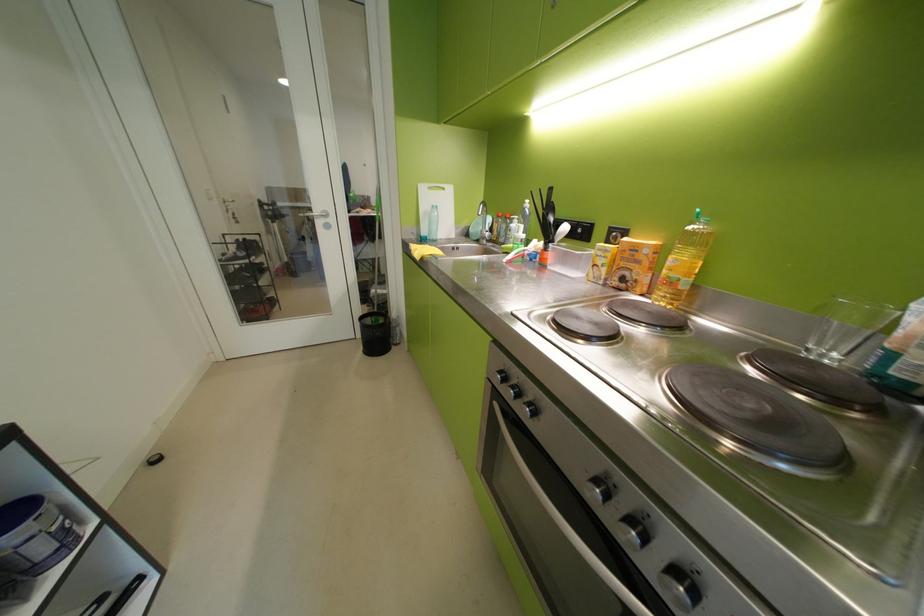
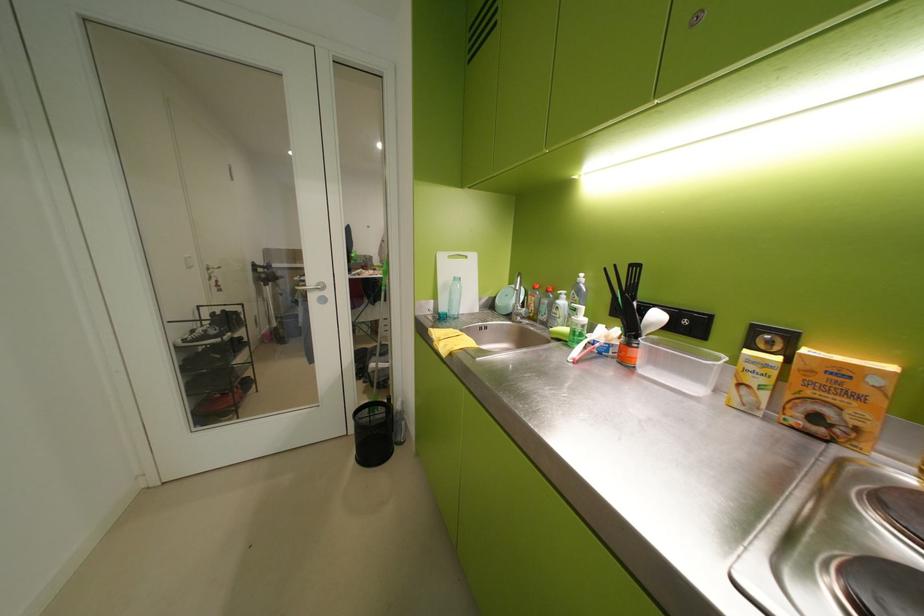
Find the pixel in the second image that matches the point at 370,336 in the first image.

(363, 432)